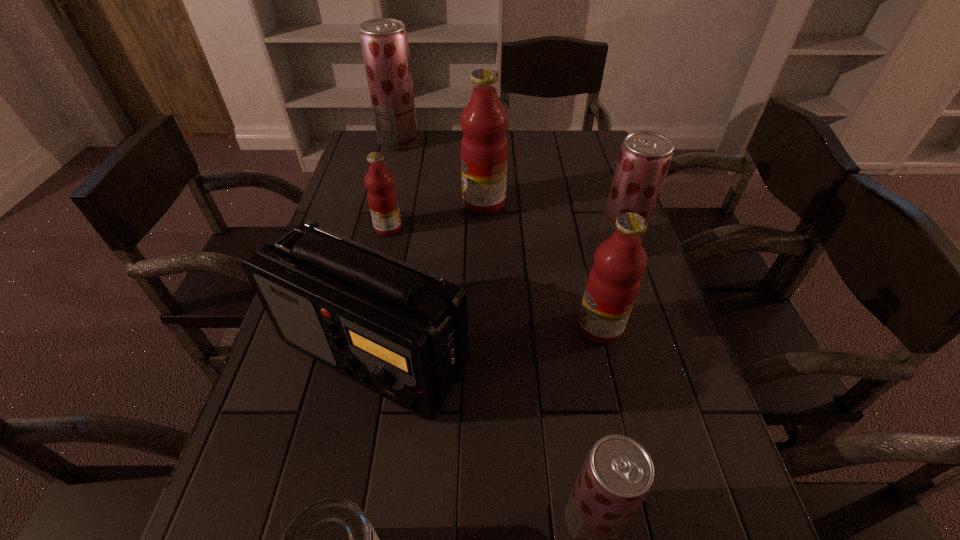
Identify the location of free space between the second nearest strawberry fruit juice and the second farthest fruit juice. (551, 224).

Locate an element on the screen. Image resolution: width=960 pixels, height=540 pixels. free area in between the second biggest pink fruit juice and the smallest pink fruit juice is located at coordinates (494, 278).

At what (x,y) coordinates should I click in order to perform the action: click on vacant region between the second smallest pink fruit juice and the leftmost strawberry fruit juice. Please return your answer as a coordinate pair (x, y). This screenshot has height=540, width=960. Looking at the image, I should click on (499, 234).

Locate an element on the screen. free area in between the second smallest strawberry fruit juice and the second farthest pink fruit juice is located at coordinates (504, 236).

At what (x,y) coordinates should I click in order to perform the action: click on free space that is in between the second pink fruit juice from left to right and the farthest strawberry fruit juice. Please return your answer as a coordinate pair (x, y). Looking at the image, I should click on (442, 172).

Find the location of a particular element. The height and width of the screenshot is (540, 960). object that is the seventh closest to the radio receiver is located at coordinates (384, 42).

Locate which object ranks second in proximity to the shortest object. Please provide its 2D coordinates. Your answer should be formatted as a tuple, i.e. [(x, y)], where the tuple contains the x and y coordinates of a point satisfying the conditions above.

[(617, 475)]

I want to click on fruit juice that stands as the second closest to the can, so click(613, 283).

At what (x,y) coordinates should I click in order to perform the action: click on fruit juice that can be found as the closest to the rightmost strawberry fruit juice. Please return your answer as a coordinate pair (x, y). Looking at the image, I should click on (613, 283).

Where is `strawberry fruit juice that is the second closest one to the can`? strawberry fruit juice that is the second closest one to the can is located at coordinates (645, 156).